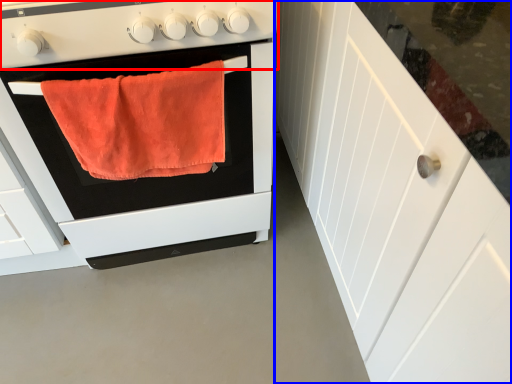
Question: Among these objects, which one is nearest to the camera, gas stove (highlighted by a red box) or cabinetry (highlighted by a blue box)?

Choices:
 (A) gas stove
 (B) cabinetry

Answer: (B)